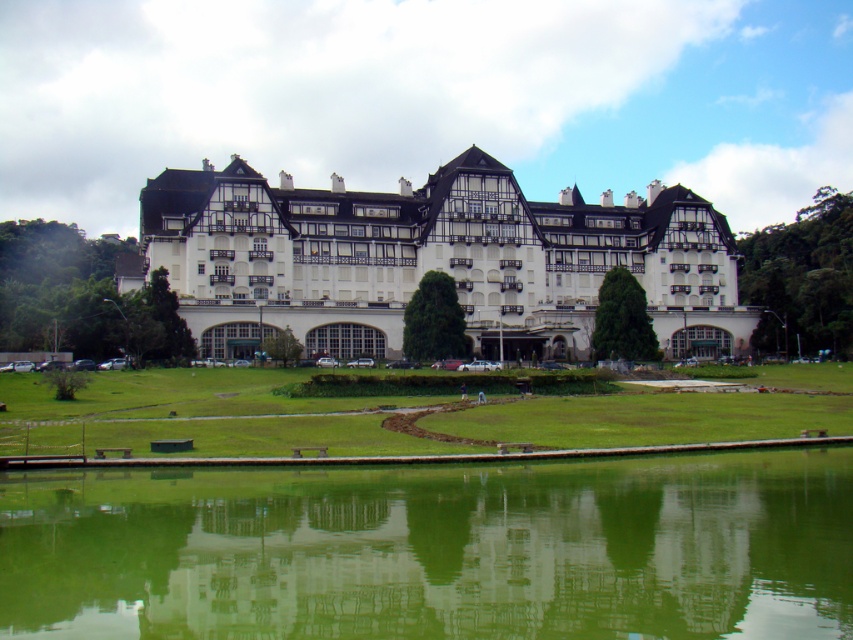
Who is more forward, (749, 454) or (663, 282)?

Point (749, 454)

Is green reflective water at center bigger than white textured building at center?

Incorrect, green reflective water at center is not larger than white textured building at center.

I want to click on green reflective water at center, so click(x=434, y=550).